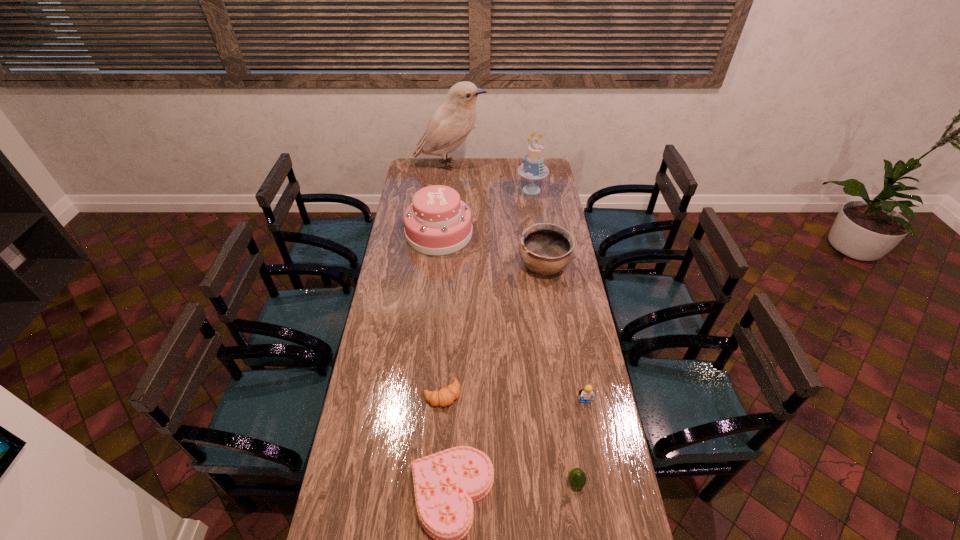
The height and width of the screenshot is (540, 960). Identify the location of vacant space that satisfies the following two spatial constraints: 1. with a ladder on the side of the seventh nearest object; 2. on the left side of the avocado. (574, 483).

The width and height of the screenshot is (960, 540). In order to click on free space that satisfies the following two spatial constraints: 1. on the face of the parakeet; 2. on the right side of the crescent roll in this screenshot , I will do (428, 394).